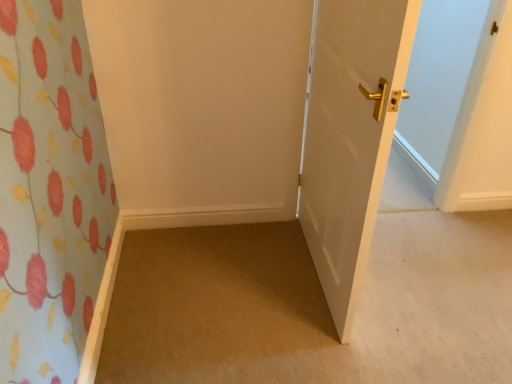
Locate an element on the screen. The width and height of the screenshot is (512, 384). vacant space to the right of white glossy door at right is located at coordinates (430, 273).